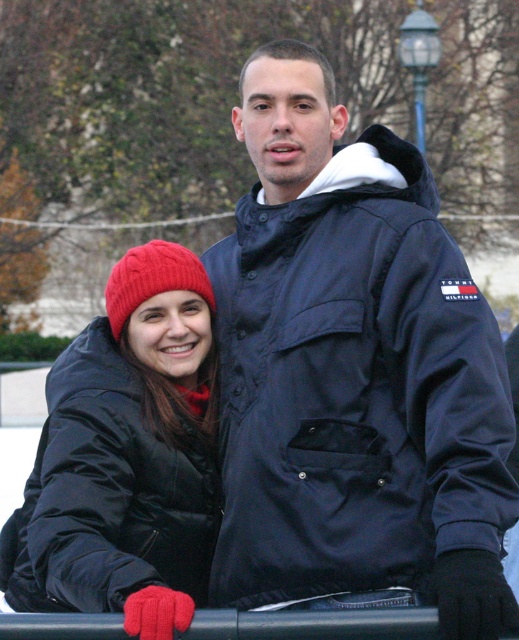
You are standing at the origin point in the image. Which of the two points, point (412,195) or point (143,296), is closer to you?

Point (412,195) is in front of point (143,296), so it is closer to you.

You are a fashion designer observing the two jackets in the scene. Which one has a larger size between the navy blue jacket at center and the matte black coat at lower left?

The navy blue jacket at center is bigger than the matte black coat at lower left.